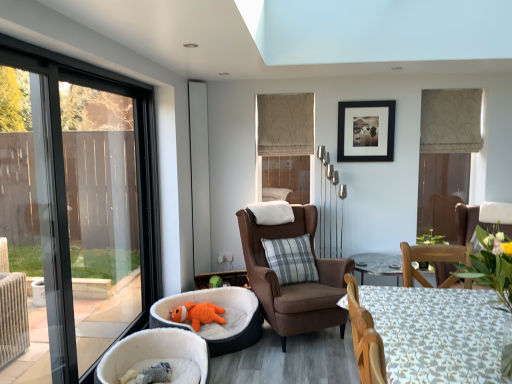
Question: Is satin silver screen door at center smaller than white fabric table at lower right?

Choices:
 (A) yes
 (B) no

Answer: (A)

Question: From the image's perspective, is satin silver screen door at center over white fabric table at lower right?

Choices:
 (A) no
 (B) yes

Answer: (B)

Question: Is satin silver screen door at center wider than white fabric table at lower right?

Choices:
 (A) yes
 (B) no

Answer: (B)

Question: Does satin silver screen door at center lie behind white fabric table at lower right?

Choices:
 (A) yes
 (B) no

Answer: (A)

Question: Considering the relative positions of satin silver screen door at center and white fabric table at lower right in the image provided, is satin silver screen door at center to the left of white fabric table at lower right from the viewer's perspective?

Choices:
 (A) no
 (B) yes

Answer: (B)

Question: Does point (281, 329) appear closer or farther from the camera than point (179, 365)?

Choices:
 (A) farther
 (B) closer

Answer: (A)

Question: In terms of width, does brown fabric chair at center, placed as the first chair when sorted from right to left, look wider or thinner when compared to white plush pet bed at lower left, which ranks as the 2th chair in back-to-front order?

Choices:
 (A) wide
 (B) thin

Answer: (A)

Question: Is brown fabric chair at center, which appears as the 1th chair when viewed from the back, bigger or smaller than white plush pet bed at lower left, which ranks as the 2th chair in back-to-front order?

Choices:
 (A) big
 (B) small

Answer: (A)

Question: From the image's perspective, relative to white plush pet bed at lower left, which ranks as the 2th chair in back-to-front order, is brown fabric chair at center, which appears as the second chair when viewed from the left, above or below?

Choices:
 (A) above
 (B) below

Answer: (A)

Question: From the image's perspective, is orange corduroy pet bed at lower left above or below satin silver screen door at center?

Choices:
 (A) below
 (B) above

Answer: (A)

Question: Based on their positions, is orange corduroy pet bed at lower left located to the left or right of satin silver screen door at center?

Choices:
 (A) left
 (B) right

Answer: (B)

Question: Looking at their shapes, would you say orange corduroy pet bed at lower left is wider or thinner than satin silver screen door at center?

Choices:
 (A) wide
 (B) thin

Answer: (A)

Question: From a real-world perspective, is orange corduroy pet bed at lower left positioned above or below satin silver screen door at center?

Choices:
 (A) below
 (B) above

Answer: (A)

Question: In terms of size, does white fabric table at lower right appear bigger or smaller than satin silver screen door at center?

Choices:
 (A) small
 (B) big

Answer: (B)

Question: Is point (398, 309) positioned closer to the camera than point (198, 254)?

Choices:
 (A) closer
 (B) farther

Answer: (A)